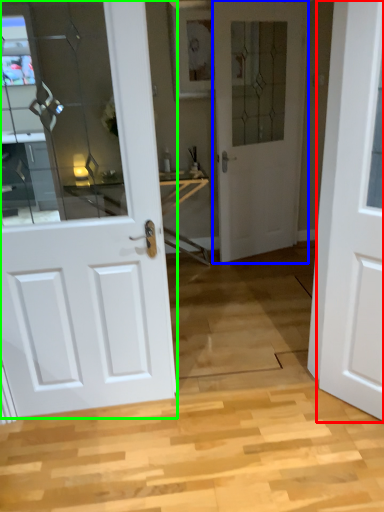
Question: Estimate the real-world distances between objects in this image. Which object is farther from door (highlighted by a red box), door (highlighted by a blue box) or door (highlighted by a green box)?

Choices:
 (A) door
 (B) door

Answer: (A)